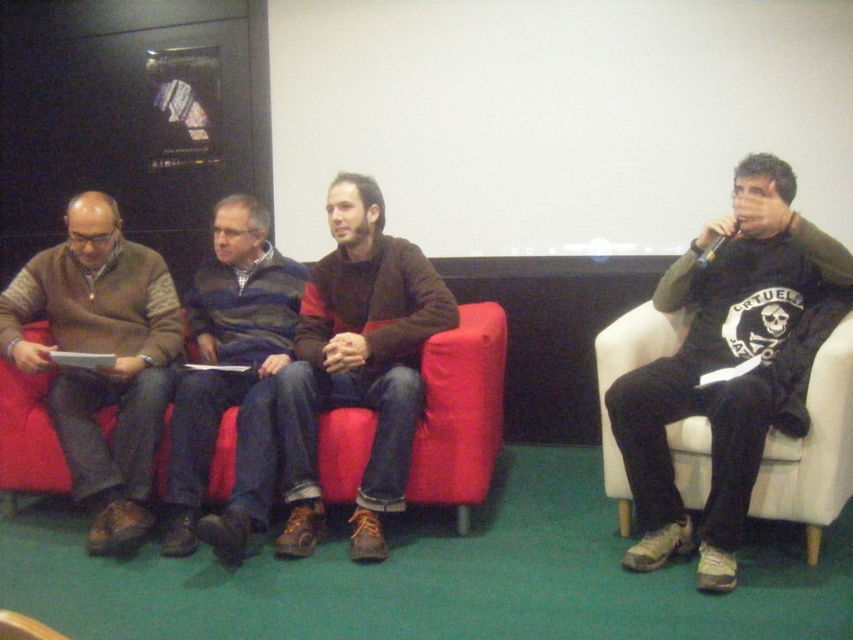
Question: Where is black matte shirt at right located in relation to blue striped sweater at center in the image?

Choices:
 (A) above
 (B) below

Answer: (A)

Question: Which of the following is the farthest from the observer?

Choices:
 (A) matte brown sweater at left
 (B) red fabric couch at center
 (C) brown suede jacket at center

Answer: (B)

Question: Is black matte shirt at right wider than matte brown sweater at left?

Choices:
 (A) no
 (B) yes

Answer: (B)

Question: Among these points, which one is farthest from the camera?

Choices:
 (A) (297, 372)
 (B) (244, 419)

Answer: (B)

Question: Does brown suede jacket at center have a greater width compared to blue striped sweater at center?

Choices:
 (A) no
 (B) yes

Answer: (B)

Question: Which object is farther from the camera taking this photo?

Choices:
 (A) blue striped sweater at center
 (B) red fabric couch at center
 (C) matte brown sweater at left
 (D) black matte shirt at right

Answer: (B)